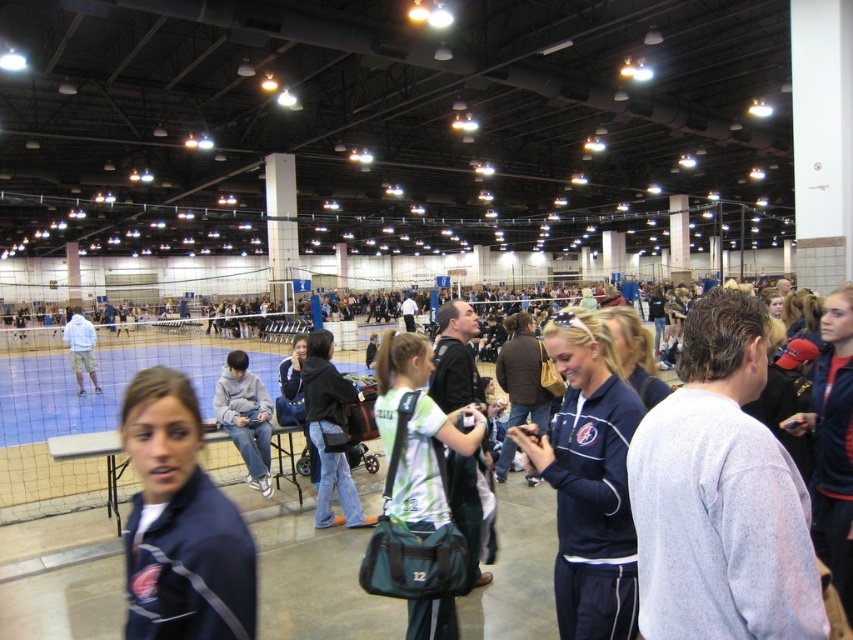
Does gray sweatshirt at center have a larger size compared to light blue hoodie at center?

No, gray sweatshirt at center is not bigger than light blue hoodie at center.

Can you confirm if gray sweatshirt at center is taller than light blue hoodie at center?

No.

You are a GUI agent. You are given a task and a screenshot of the screen. Output one action in this format:
    pyautogui.click(x=<x>, y=<y>)
    Task: Click on the gray sweatshirt at center
    
    Given the screenshot: What is the action you would take?
    pyautogui.click(x=721, y=496)

Which is above, gray sweatshirt at center or denim jacket at center?

gray sweatshirt at center is above.

Which of these two, gray sweatshirt at center or denim jacket at center, stands shorter?

gray sweatshirt at center is shorter.

This screenshot has height=640, width=853. I want to click on gray sweatshirt at center, so click(721, 496).

Who is shorter, navy blue jacket at center or navy blue tracksuit at center?

Standing shorter between the two is navy blue jacket at center.

Is navy blue jacket at center thinner than navy blue tracksuit at center?

Correct, navy blue jacket at center's width is less than navy blue tracksuit at center's.

What do you see at coordinates (180, 524) in the screenshot?
I see `navy blue jacket at center` at bounding box center [180, 524].

You are a GUI agent. You are given a task and a screenshot of the screen. Output one action in this format:
    pyautogui.click(x=<x>, y=<y>)
    Task: Click on the navy blue jacket at center
    The height and width of the screenshot is (640, 853).
    Given the screenshot: What is the action you would take?
    pyautogui.click(x=180, y=524)